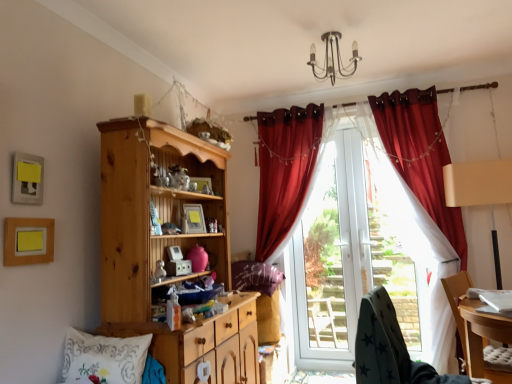
Measure the distance between point [40,165] and camera.

A distance of 6.04 feet exists between point [40,165] and camera.

Locate an element on the screen. The height and width of the screenshot is (384, 512). wooden picture frame at lower left, the 4th picture frame viewed from the back is located at coordinates pyautogui.click(x=28, y=241).

What do you see at coordinates (166, 247) in the screenshot? The width and height of the screenshot is (512, 384). I see `natural wood cabinet at left` at bounding box center [166, 247].

Image resolution: width=512 pixels, height=384 pixels. Identify the location of matte yellow picture frame at upper left, arranged as the 3th picture frame when viewed from the back. (27, 179).

Which object is positioned more to the left, white glossy screen door at center or wooden picture frame at upper center, which is counted as the 1th picture frame, starting from the back?

wooden picture frame at upper center, which is counted as the 1th picture frame, starting from the back, is more to the left.

Does point (364, 279) lie in front of point (197, 179)?

No, it is not.

Which picture frame is the 1st one when counting from the left side of the white glossy screen door at center? Please provide its 2D coordinates.

[(201, 184)]

Does metallic silver figurine at center have a lesser height compared to wooden picture frame at upper center, the 4th picture frame when ordered from front to back?

Indeed, metallic silver figurine at center has a lesser height compared to wooden picture frame at upper center, the 4th picture frame when ordered from front to back.

Considering the positions of objects metallic silver figurine at center and wooden picture frame at upper center, the 4th picture frame when ordered from front to back, in the image provided, who is more to the right, metallic silver figurine at center or wooden picture frame at upper center, the 4th picture frame when ordered from front to back,?

From the viewer's perspective, wooden picture frame at upper center, the 4th picture frame when ordered from front to back, appears more on the right side.

Is metallic silver figurine at center far from wooden picture frame at upper center, positioned as the 1th picture frame in right-to-left order?

No.

From the image's perspective, is metallic silver figurine at center located beneath wooden picture frame at upper center, which is the fourth picture frame from left to right?

Yes, from the image's perspective, metallic silver figurine at center is below wooden picture frame at upper center, which is the fourth picture frame from left to right.

Consider the image. From the image's perspective, relative to metallic chandelier at upper center, is natural wood cabinet at left above or below?

natural wood cabinet at left is situated lower than metallic chandelier at upper center in the image.

Can you confirm if natural wood cabinet at left is positioned to the left of metallic chandelier at upper center?

Indeed, natural wood cabinet at left is positioned on the left side of metallic chandelier at upper center.

Can you confirm if natural wood cabinet at left is taller than metallic chandelier at upper center?

Yes.

Considering the relative sizes of dark grey fabric chair at lower right, positioned as the second chair in right-to-left order, and white embroidered pillow at lower left, the 2th pillow viewed from the back, in the image provided, is dark grey fabric chair at lower right, positioned as the second chair in right-to-left order, thinner than white embroidered pillow at lower left, the 2th pillow viewed from the back,?

No.

At what (x,y) coordinates should I click in order to perform the action: click on chair in front of the white embroidered pillow at lower left, the 1th pillow from the left. Please return your answer as a coordinate pair (x, y). The height and width of the screenshot is (384, 512). Looking at the image, I should click on (390, 348).

Can you confirm if dark grey fabric chair at lower right, positioned as the second chair in right-to-left order, is smaller than white embroidered pillow at lower left, the second pillow positioned from the right?

Incorrect, dark grey fabric chair at lower right, positioned as the second chair in right-to-left order, is not smaller in size than white embroidered pillow at lower left, the second pillow positioned from the right.

Is dark grey fabric chair at lower right, positioned as the second chair in right-to-left order, oriented towards white embroidered pillow at lower left, the 2th pillow viewed from the back?

No, dark grey fabric chair at lower right, positioned as the second chair in right-to-left order, is not aimed at white embroidered pillow at lower left, the 2th pillow viewed from the back.

Considering the relative sizes of white embroidered pillow at lower left, the 1th pillow from the left, and metallic silver figurine at center in the image provided, is white embroidered pillow at lower left, the 1th pillow from the left, taller than metallic silver figurine at center?

Correct, white embroidered pillow at lower left, the 1th pillow from the left, is much taller as metallic silver figurine at center.

How many degrees apart are the facing directions of white embroidered pillow at lower left, the 2th pillow viewed from the back, and metallic silver figurine at center?

85.6 degrees.

Is white embroidered pillow at lower left, the 2th pillow viewed from the back, inside or outside of metallic silver figurine at center?

white embroidered pillow at lower left, the 2th pillow viewed from the back, lies outside metallic silver figurine at center.

Which object is more forward, white embroidered pillow at lower left, the 2th pillow viewed from the back, or metallic silver figurine at center?

white embroidered pillow at lower left, the 2th pillow viewed from the back, is closer to the camera.

Are metallic chandelier at upper center and metallic silver figurine at center located far from each other?

Yes.

Is metallic chandelier at upper center facing away from metallic silver figurine at center?

metallic chandelier at upper center is not turned away from metallic silver figurine at center.

The image size is (512, 384). What are the coordinates of `toy that appears behind the metallic chandelier at upper center` in the screenshot? It's located at (159, 272).

From the image's perspective, is wooden chair at lower right, the 1th chair in the right-to-left sequence, beneath transparent glass door at center?

Correct, wooden chair at lower right, the 1th chair in the right-to-left sequence, appears lower than transparent glass door at center in the image.

Is wooden chair at lower right, the 1th chair in the right-to-left sequence, further to camera compared to transparent glass door at center?

No, wooden chair at lower right, the 1th chair in the right-to-left sequence, is in front of transparent glass door at center.

Considering the sizes of wooden chair at lower right, which appears as the second chair when viewed from the left, and transparent glass door at center in the image, is wooden chair at lower right, which appears as the second chair when viewed from the left, wider or thinner than transparent glass door at center?

Clearly, wooden chair at lower right, which appears as the second chair when viewed from the left, has more width compared to transparent glass door at center.

Which of these two, wooden chair at lower right, which appears as the second chair when viewed from the left, or transparent glass door at center, is bigger?

Bigger between the two is transparent glass door at center.

From the image's perspective, which picture frame is the 3rd one above the white glossy screen door at center? Please provide its 2D coordinates.

[(201, 184)]

Where is `picture frame that is the 2nd object to the right of the metallic silver figurine at center, starting at the anchor`? The image size is (512, 384). picture frame that is the 2nd object to the right of the metallic silver figurine at center, starting at the anchor is located at coordinates (201, 184).

From the image, which object appears to be nearer to wooden picture frame at upper center, which is the fourth picture frame from left to right, metallic chandelier at upper center or natural wood cabinet at left?

natural wood cabinet at left.

When comparing their distances from matte wooden picture frame at center, the 2th picture frame in the back-to-front sequence, does transparent glass door at center or wooden picture frame at lower left, acting as the first picture frame starting from the front, seem closer?

Among the two, wooden picture frame at lower left, acting as the first picture frame starting from the front, is located nearer to matte wooden picture frame at center, the 2th picture frame in the back-to-front sequence.

Which object lies further to the anchor point metallic chandelier at upper center, wooden picture frame at lower left, the 4th picture frame viewed from the back, or wooden picture frame at upper center, which is counted as the 1th picture frame, starting from the back?

wooden picture frame at lower left, the 4th picture frame viewed from the back.

Estimate the real-world distances between objects in this image. Which object is further from matte yellow picture frame at upper left, marked as the 2th picture frame in a front-to-back arrangement, white glossy screen door at center or matte wooden picture frame at center, which appears as the 3th picture frame when viewed from the left?

The object further to matte yellow picture frame at upper left, marked as the 2th picture frame in a front-to-back arrangement, is white glossy screen door at center.

Estimate the real-world distances between objects in this image. Which object is further from white embroidered pillow at lower left, the second pillow positioned from the right, wooden picture frame at upper center, which is counted as the 1th picture frame, starting from the back, or purple fabric pillow at center, the 2th pillow from the left?

purple fabric pillow at center, the 2th pillow from the left.

Looking at the image, which one is located closer to white embroidered pillow at lower left, the 1th pillow from the left, metallic chandelier at upper center or wooden picture frame at lower left, positioned as the second picture frame in left-to-right order?

The object closer to white embroidered pillow at lower left, the 1th pillow from the left, is wooden picture frame at lower left, positioned as the second picture frame in left-to-right order.

Which object lies nearer to the anchor point dark grey fabric chair at lower right, positioned as the second chair in right-to-left order, natural wood cabinet at left or purple fabric pillow at center, which is counted as the first pillow, starting from the right?

natural wood cabinet at left.

Estimate the real-world distances between objects in this image. Which object is further from wooden picture frame at lower left, positioned as the second picture frame in left-to-right order, transparent glass door at center or metallic chandelier at upper center?

Among the two, transparent glass door at center is located further to wooden picture frame at lower left, positioned as the second picture frame in left-to-right order.

Where is `window screen located between white embroidered pillow at lower left, the second pillow positioned from the right, and wooden chair at lower right, which appears as the second chair when viewed from the left, in the left-right direction`? The height and width of the screenshot is (384, 512). window screen located between white embroidered pillow at lower left, the second pillow positioned from the right, and wooden chair at lower right, which appears as the second chair when viewed from the left, in the left-right direction is located at coordinates (354, 243).

I want to click on toy positioned between white embroidered pillow at lower left, the 2th pillow viewed from the back, and white glossy screen door at center from near to far, so (159, 272).

At what (x,y) coordinates should I click in order to perform the action: click on pillow between matte wooden picture frame at center, arranged as the 3th picture frame when viewed from the front, and transparent glass door at center. Please return your answer as a coordinate pair (x, y). Looking at the image, I should click on (255, 277).

This screenshot has width=512, height=384. What are the coordinates of `window screen between metallic chandelier at upper center and purple fabric pillow at center, which is the 1th pillow in back-to-front order, in the vertical direction` in the screenshot? It's located at (354, 243).